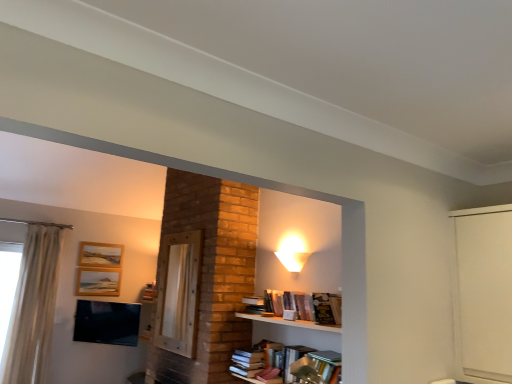
Question: Is white sheer curtain at left turned away from wooden picture frame at upper left, which appears as the 1th picture frame when ordered from the bottom?

Choices:
 (A) no
 (B) yes

Answer: (A)

Question: Is white sheer curtain at left positioned behind wooden picture frame at upper left, which appears as the 1th picture frame when ordered from the bottom?

Choices:
 (A) no
 (B) yes

Answer: (A)

Question: From the image's perspective, is white sheer curtain at left over wooden picture frame at upper left, which appears as the 1th picture frame when ordered from the bottom?

Choices:
 (A) yes
 (B) no

Answer: (B)

Question: Does white sheer curtain at left contain wooden picture frame at upper left, which is the second picture frame in top-to-bottom order?

Choices:
 (A) yes
 (B) no

Answer: (B)

Question: Considering the relative sizes of white sheer curtain at left and wooden picture frame at upper left, which appears as the 1th picture frame when ordered from the bottom, in the image provided, is white sheer curtain at left shorter than wooden picture frame at upper left, which appears as the 1th picture frame when ordered from the bottom,?

Choices:
 (A) yes
 (B) no

Answer: (B)

Question: Considering the positions of matte black tv at lower left and white sheer curtain at left in the image, is matte black tv at lower left taller or shorter than white sheer curtain at left?

Choices:
 (A) short
 (B) tall

Answer: (A)

Question: Is matte black tv at lower left to the left or to the right of white sheer curtain at left in the image?

Choices:
 (A) left
 (B) right

Answer: (B)

Question: From a real-world perspective, is matte black tv at lower left physically located above or below white sheer curtain at left?

Choices:
 (A) above
 (B) below

Answer: (B)

Question: Choose the correct answer: Is matte black tv at lower left inside white sheer curtain at left or outside it?

Choices:
 (A) outside
 (B) inside

Answer: (A)

Question: From the image's perspective, is wooden picture frame at upper left, acting as the 2th picture frame starting from the bottom, above or below matte black tv at lower left?

Choices:
 (A) above
 (B) below

Answer: (A)

Question: In terms of height, does wooden picture frame at upper left, marked as the 1th picture frame in a top-to-bottom arrangement, look taller or shorter compared to matte black tv at lower left?

Choices:
 (A) tall
 (B) short

Answer: (B)

Question: From a real-world perspective, is wooden picture frame at upper left, acting as the 2th picture frame starting from the bottom, physically located above or below matte black tv at lower left?

Choices:
 (A) above
 (B) below

Answer: (A)

Question: Looking at their shapes, would you say wooden picture frame at upper left, marked as the 1th picture frame in a top-to-bottom arrangement, is wider or thinner than matte black tv at lower left?

Choices:
 (A) thin
 (B) wide

Answer: (A)

Question: Is hardcover books at center taller or shorter than wooden picture frame at upper left, which appears as the 1th picture frame when ordered from the bottom?

Choices:
 (A) tall
 (B) short

Answer: (B)

Question: Do you think hardcover books at center is within wooden picture frame at upper left, which is the second picture frame in top-to-bottom order, or outside of it?

Choices:
 (A) inside
 (B) outside

Answer: (B)